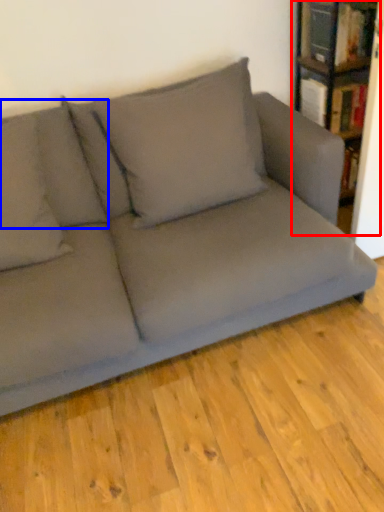
Question: Which object is closer to the camera taking this photo, bookcase (highlighted by a red box) or pillow (highlighted by a blue box)?

Choices:
 (A) bookcase
 (B) pillow

Answer: (B)